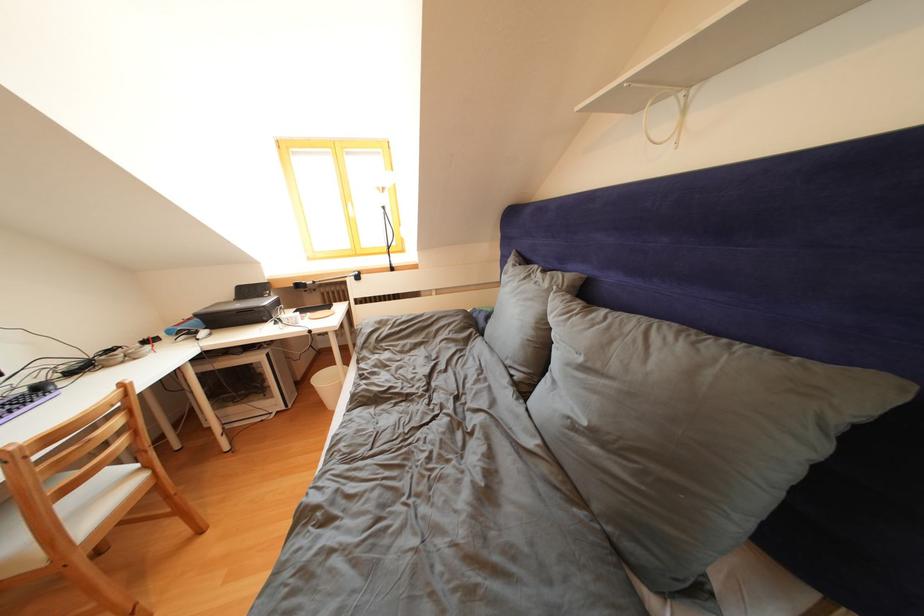
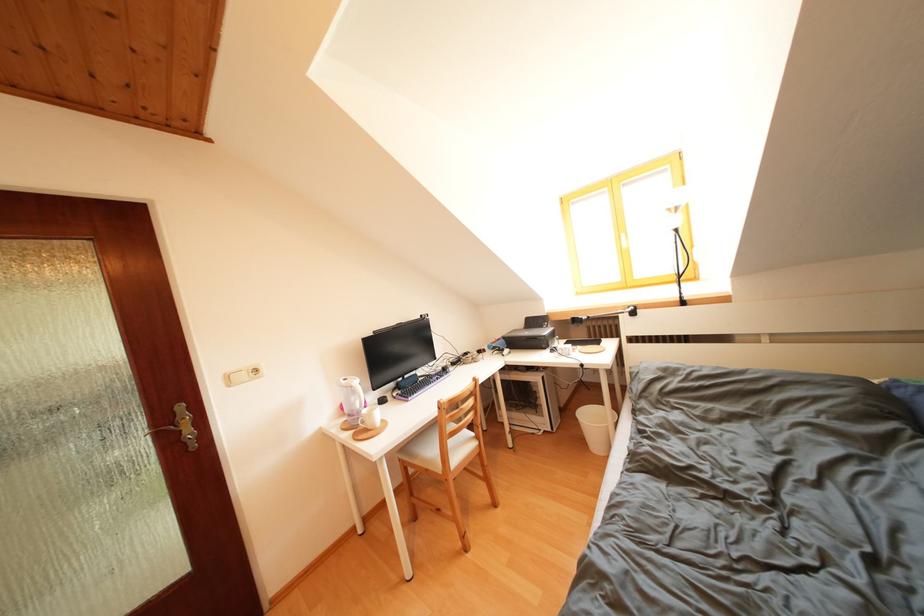
Question: The camera is either moving clockwise (left) or counter-clockwise (right) around the object. The first image is from the beginning of the video and the second image is from the end. Is the camera moving left or right when shooting the video?

Choices:
 (A) Left
 (B) Right

Answer: (B)